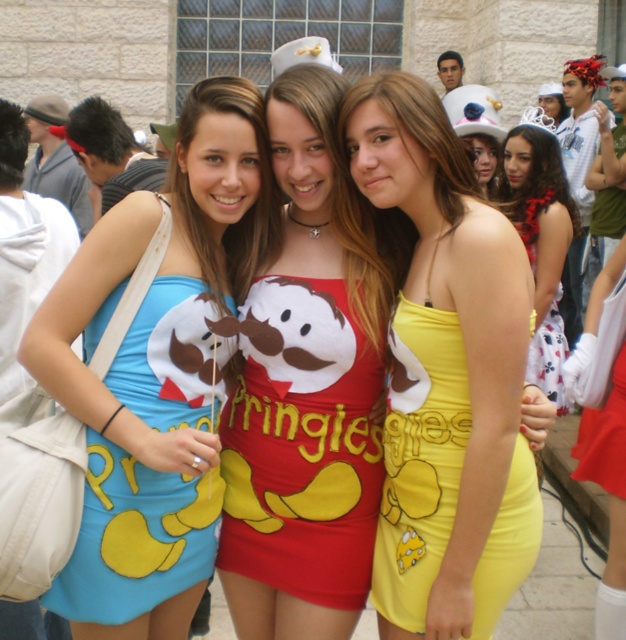
You are a photographer trying to capture the matte blue dress at center in the image. The camera is set to focus on the point at coordinates point [158,371]. Will this point be on the matte blue dress at center?

Yes, the point [158,371] indicates the location of the matte blue dress at center, so focusing there will capture it.

You are a photographer trying to capture the three women in their Pringles outfits. You notice the yellow satin dress at center is exactly at point [444,376]. Where should you position the focus point to ensure the yellow satin dress at center is sharp in the photo?

The yellow satin dress at center is represented by point [444,376], so you should position the focus point at [444,376] to ensure it is sharp.

You are a photographer trying to capture a clear shot of the yellow satin dress at center and the matte red dress at center. Which dress should you focus on first to ensure it appears sharp in the photo?

The yellow satin dress at center is closer to the viewer than the matte red dress at center, so you should focus on the yellow satin dress at center first to ensure it appears sharp.